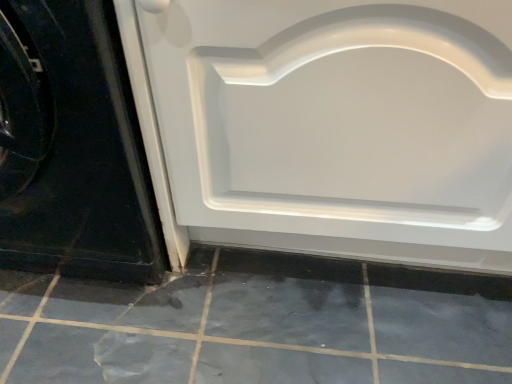
Question: From a real-world perspective, relative to white glossy door at center, marked as the first door in a right-to-left arrangement, is gray matte tile at lower center vertically above or below?

Choices:
 (A) above
 (B) below

Answer: (B)

Question: Based on their positions, is gray matte tile at lower center located to the left or right of white glossy door at center, marked as the first door in a right-to-left arrangement?

Choices:
 (A) left
 (B) right

Answer: (A)

Question: Which object is positioned farthest from the white glossy door at lower left, which is the first door from left to right?

Choices:
 (A) white glossy door at center, which appears as the 2th door when viewed from the left
 (B) gray matte tile at lower center

Answer: (B)

Question: Which object is the closest to the gray matte tile at lower center?

Choices:
 (A) white glossy door at lower left, which is the first door from left to right
 (B) white glossy door at center, which appears as the 2th door when viewed from the left

Answer: (B)